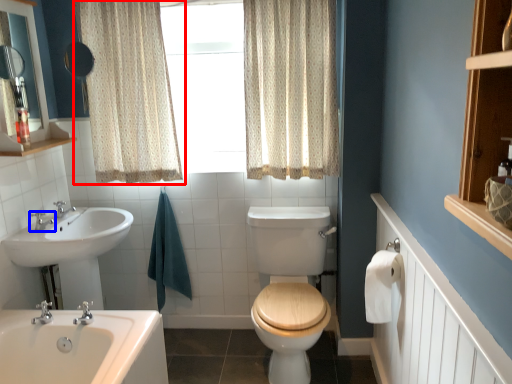
Question: Which object appears farthest to the camera in this image, curtain (highlighted by a red box) or tap (highlighted by a blue box)?

Choices:
 (A) curtain
 (B) tap

Answer: (B)